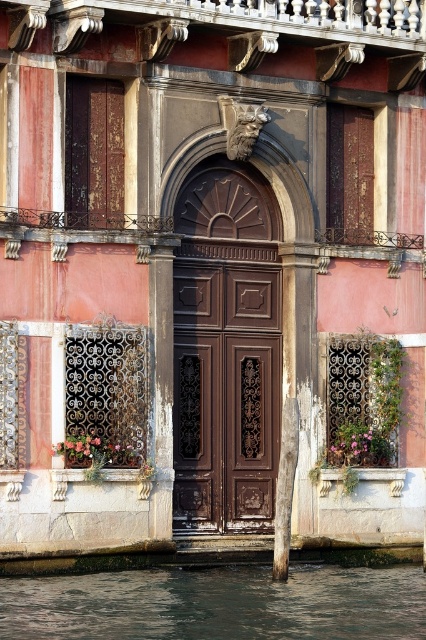
You are standing in front of the building with the entrance door and canal. You see two points marked on the building. The first point is at coordinates point (x=275, y=291) and the second is at point (x=37, y=586). Which of these points is closer to you?

Point (x=37, y=586) is closer to you because it is less further to the camera than point (x=275, y=291).

You are standing in front of the building entrance. There is a point marked at coordinates (226,385). What is located at that point?

The point at coordinates (226,385) indicates dark wood paneling at center.

You are a tourist standing at the entrance of the building facing the canal. You want to take a photo of both the dark wood paneling at center and the dark green water at lower left in the same frame. Given that your camera has a 50mm lens, which has a field of view that can capture objects up to 6 meters apart in the frame, will you be able to include both objects in a single photo?

The dark wood paneling at center is 7.23 meters away from the dark green water at lower left. Since the camera lens can only capture up to 6 meters between objects, you won not be able to include both in the same frame.